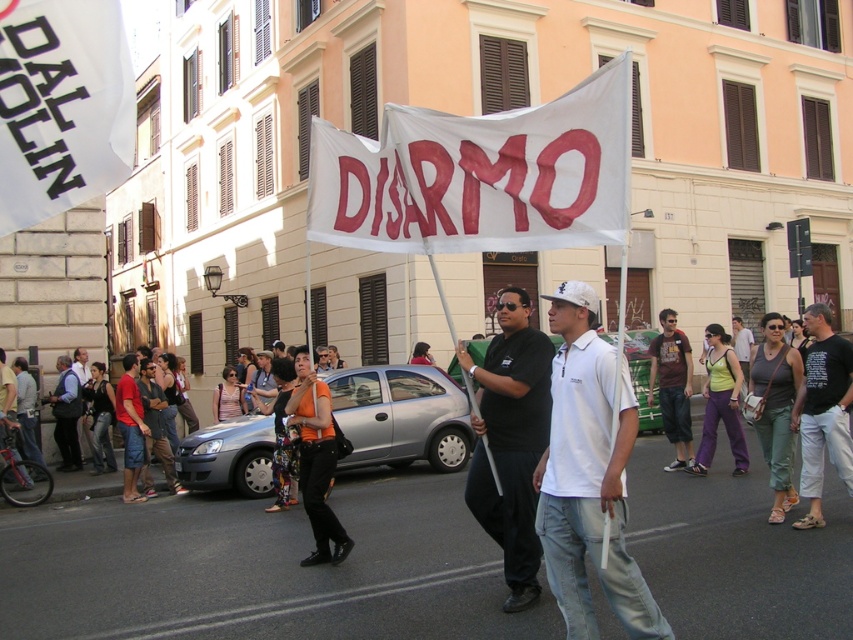
Question: Can you confirm if black cotton t-shirt at center is bigger than dark blue jeans at lower left?

Choices:
 (A) yes
 (B) no

Answer: (A)

Question: Among these points, which one is nearest to the camera?

Choices:
 (A) (80, 372)
 (B) (746, 374)

Answer: (A)

Question: Which is nearer to the brown fabric shirt at center?

Choices:
 (A) dark gray vest at left
 (B) matte black shirt at center
 (C) dark blue jeans at lower left

Answer: (B)

Question: Which object is the closest to the dark blue jeans at lower left?

Choices:
 (A) black matte shirt at center
 (B) white paper flag at upper left

Answer: (A)

Question: From the image, what is the correct spatial relationship of black cotton t-shirt at center in relation to dark gray shirt at center?

Choices:
 (A) left
 (B) right

Answer: (B)

Question: Is white paper flag at upper left to the left of brown fabric shirt at center from the viewer's perspective?

Choices:
 (A) no
 (B) yes

Answer: (B)